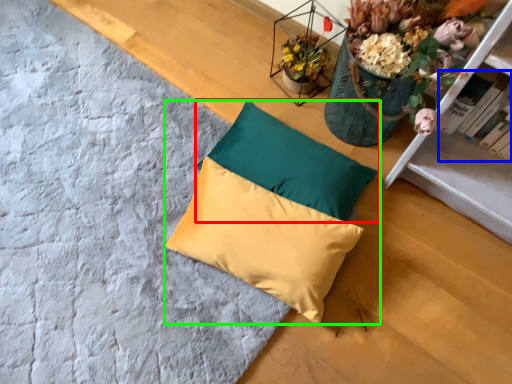
Question: Estimate the real-world distances between objects in this image. Which object is farther from pillow (highlighted by a red box), book (highlighted by a blue box) or pillow (highlighted by a green box)?

Choices:
 (A) book
 (B) pillow

Answer: (A)